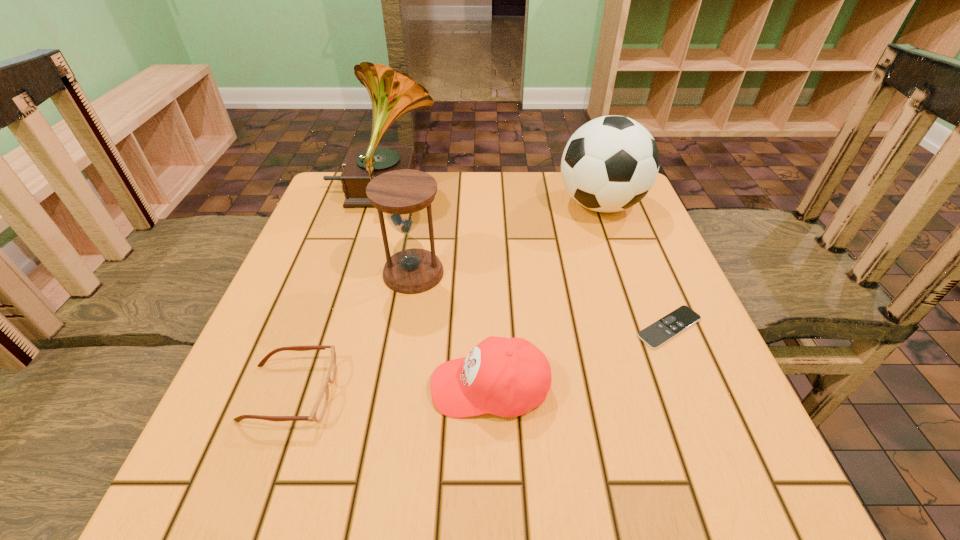
You are a GUI agent. You are given a task and a screenshot of the screen. Output one action in this format:
    pyautogui.click(x=<x>, y=<y>)
    Task: Click on the empty space between the fourth nearest object and the baseball cap
    This screenshot has width=960, height=540.
    Given the screenshot: What is the action you would take?
    pyautogui.click(x=451, y=330)

Locate an element on the screen. The image size is (960, 540). free spot between the baseball cap and the shortest object is located at coordinates [579, 357].

At what (x,y) coordinates should I click in order to perform the action: click on free spot between the phonograph record and the second shortest object. Please return your answer as a coordinate pair (x, y). The image size is (960, 540). Looking at the image, I should click on (337, 292).

At what (x,y) coordinates should I click in order to perform the action: click on empty location between the fifth tallest object and the hourglass. Please return your answer as a coordinate pair (x, y). Looking at the image, I should click on (352, 333).

The image size is (960, 540). In order to click on free space between the shortest object and the third farthest object in this screenshot , I will do `click(541, 300)`.

Locate an element on the screen. The height and width of the screenshot is (540, 960). free space between the spectacles and the phonograph record is located at coordinates (337, 292).

At what (x,y) coordinates should I click in order to perform the action: click on vacant space that is in between the third shortest object and the hourglass. Please return your answer as a coordinate pair (x, y). This screenshot has height=540, width=960. Looking at the image, I should click on (451, 330).

The height and width of the screenshot is (540, 960). What are the coordinates of `empty location between the third farthest object and the third nearest object` in the screenshot? It's located at (541, 300).

Locate an element on the screen. Image resolution: width=960 pixels, height=540 pixels. free space that is in between the baseball cap and the phonograph record is located at coordinates (436, 289).

At what (x,y) coordinates should I click in order to perform the action: click on object that is the third closest one to the soccer ball. Please return your answer as a coordinate pair (x, y). Looking at the image, I should click on (392, 93).